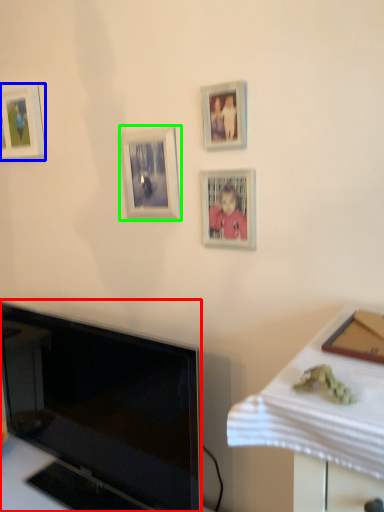
Question: Which object is the farthest from television (highlighted by a red box)? Choose among these: picture frame (highlighted by a blue box) or picture frame (highlighted by a green box).

Choices:
 (A) picture frame
 (B) picture frame

Answer: (A)